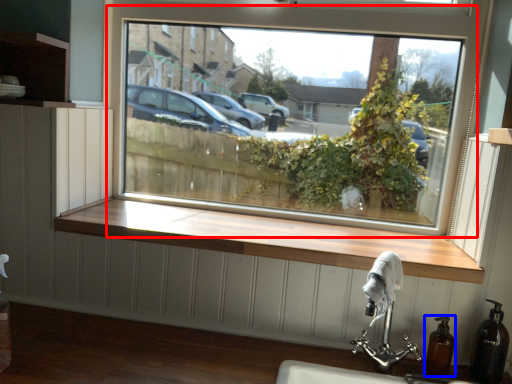
Question: Which of the following is the farthest to the observer, window (highlighted by a red box) or soap dispenser (highlighted by a blue box)?

Choices:
 (A) window
 (B) soap dispenser

Answer: (A)